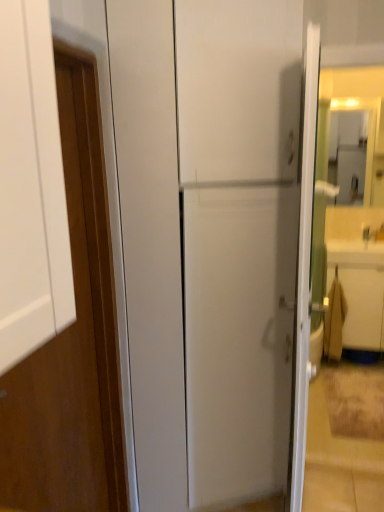
Question: In terms of size, does beige fabric drawer at right appear bigger or smaller than wooden door at left?

Choices:
 (A) small
 (B) big

Answer: (B)

Question: Considering their positions, is beige fabric drawer at right located in front of or behind wooden door at left?

Choices:
 (A) behind
 (B) front

Answer: (A)

Question: In the image, is beige fabric drawer at right on the left side or the right side of wooden door at left?

Choices:
 (A) left
 (B) right

Answer: (B)

Question: Considering the positions of wooden door at left and beige fabric drawer at right in the image, is wooden door at left wider or thinner than beige fabric drawer at right?

Choices:
 (A) wide
 (B) thin

Answer: (B)

Question: Would you say wooden door at left is to the left or to the right of beige fabric drawer at right in the picture?

Choices:
 (A) left
 (B) right

Answer: (A)

Question: Is point (69, 404) positioned closer to the camera than point (377, 324)?

Choices:
 (A) farther
 (B) closer

Answer: (B)

Question: From the image's perspective, is wooden door at left positioned above or below beige fabric drawer at right?

Choices:
 (A) below
 (B) above

Answer: (B)